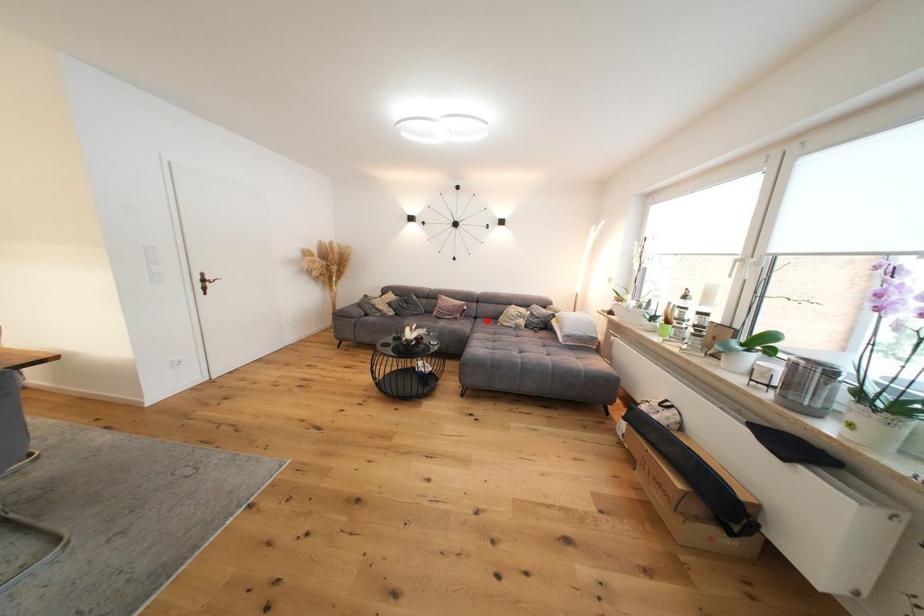
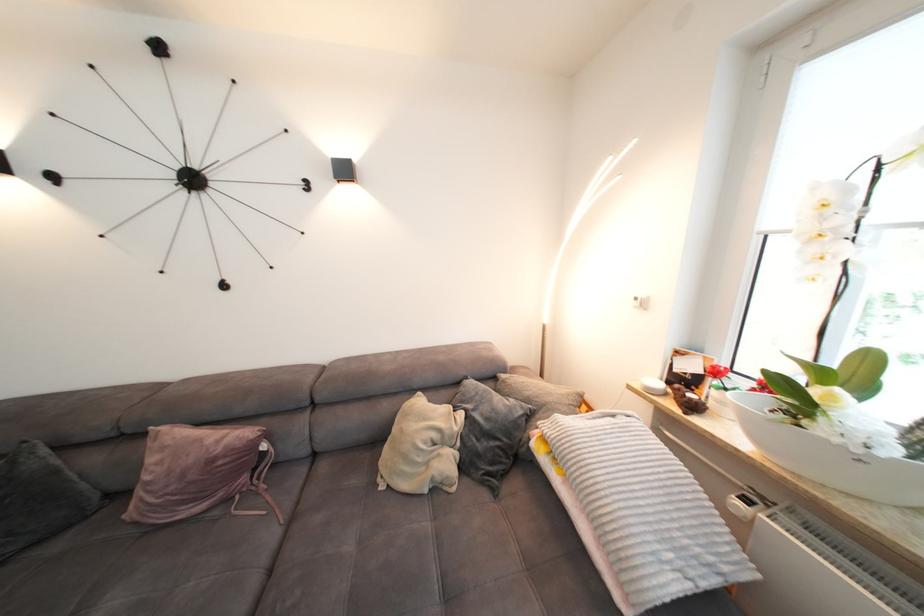
Where in the second image is the point corresponding to the highlighted location from the first image?

(330, 469)